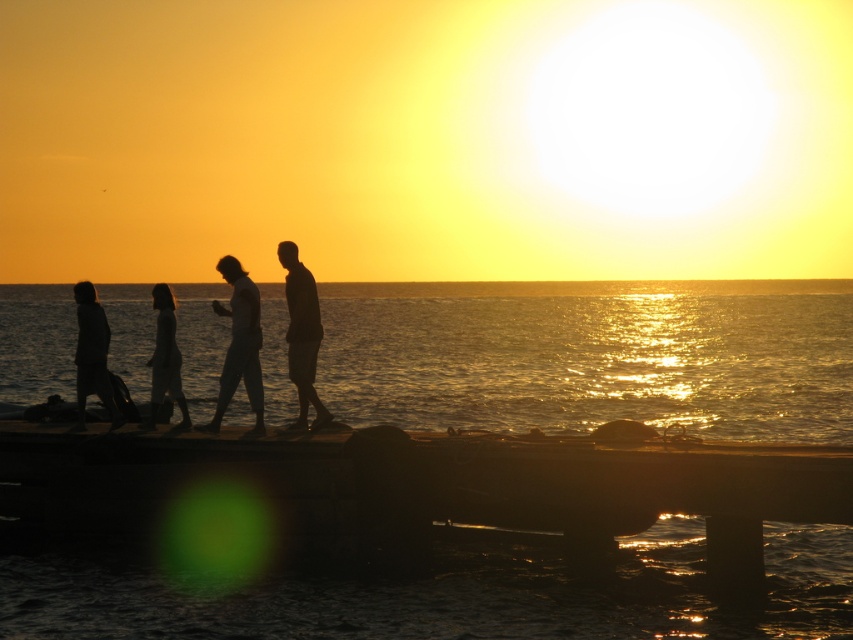
You are standing at the point marked as point (x=426, y=483). What object is located exactly at this coordinate?

The smooth concrete dock at center is located exactly at point (x=426, y=483).

You are standing at the point marked by coordinates point (426, 483) on the smooth concrete dock at center. Looking towards the sunset, which direction should you turn to face the wooden pier where the four people are walking?

The wooden pier where the four people are walking is located extending into the sea from the shore. Since you are on the smooth concrete dock at center marked by point (426, 483), you should turn towards the wooden pier direction. However, based on the scene description, the pier is part of the dock structure. Therefore, facing the sunset, you would need to turn towards the shore or seaward direction depending on the pier location. But since the people are on the pier extending into the sea, turning seawa